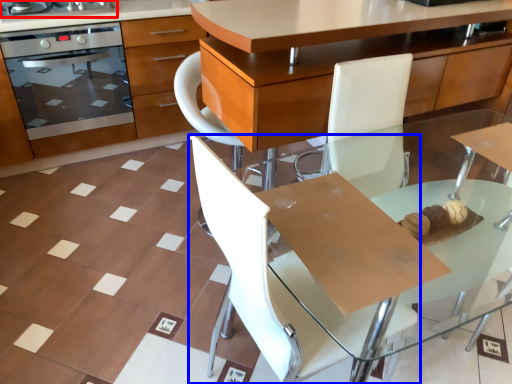
Question: Which of the following is the closest to the observer, home appliance (highlighted by a red box) or chair (highlighted by a blue box)?

Choices:
 (A) home appliance
 (B) chair

Answer: (B)